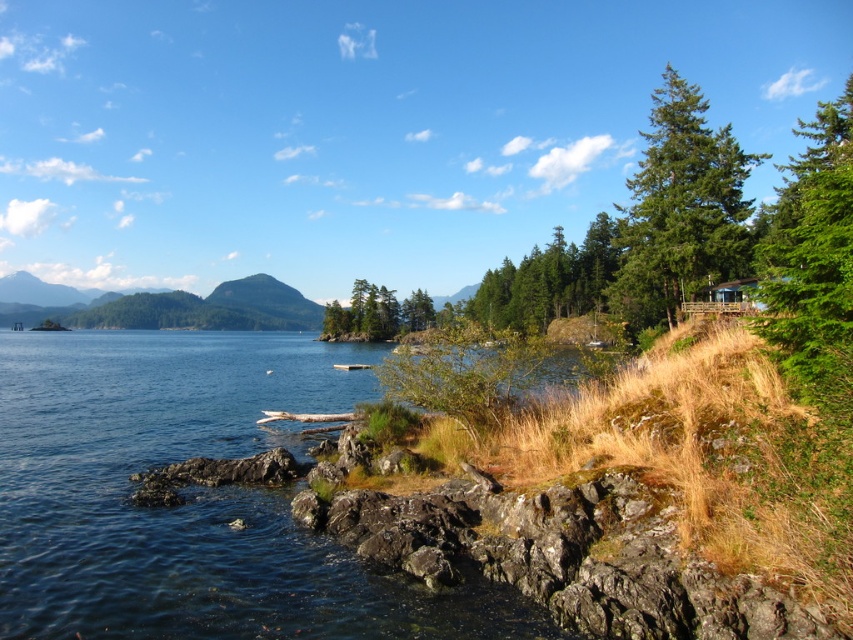
You are a hiker standing at the shoreline and want to take a photo of the green textured tree at upper right. Which direction should you face to capture it in your view?

The green textured tree at upper right is located at point (680, 209), which is in the upper right direction from your position at the shoreline. Face towards the upper right to capture it in your view.

You are an ornithologist observing birds in the coastal landscape. You notice two green trees at the upper right corner of the image. Which tree would be more suitable for a bird to build a nest in terms of size? Please refer to the trees labeled as green textured tree at upper right and green matte tree at upper right.

The green matte tree at upper right is larger in size compared to the green textured tree at upper right, making it more suitable for a bird to build a nest.

You are standing at the shoreline looking towards the wooden structure. Which tree, the green textured tree at upper right or the green matte tree at center, blocks your view of the wooden structure more?

The green textured tree at upper right is in front of the green matte tree at center, so it blocks the view of the wooden structure more.